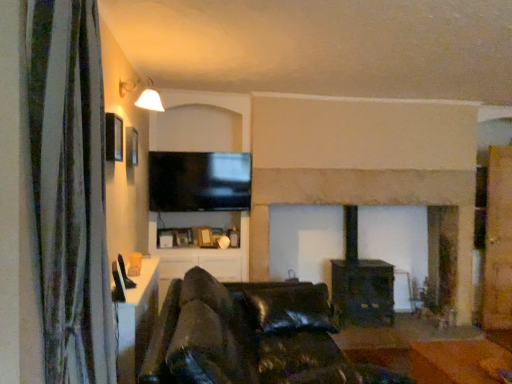
This screenshot has width=512, height=384. I want to click on vacant region above orange leather couch at lower center (from a real-world perspective), so click(x=458, y=357).